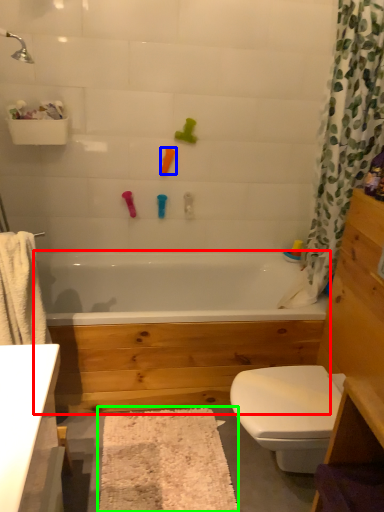
Question: Based on their relative distances, which object is farther from bathtub (highlighted by a red box)? Choose from toy (highlighted by a blue box) and bath mat (highlighted by a green box).

Choices:
 (A) toy
 (B) bath mat

Answer: (A)